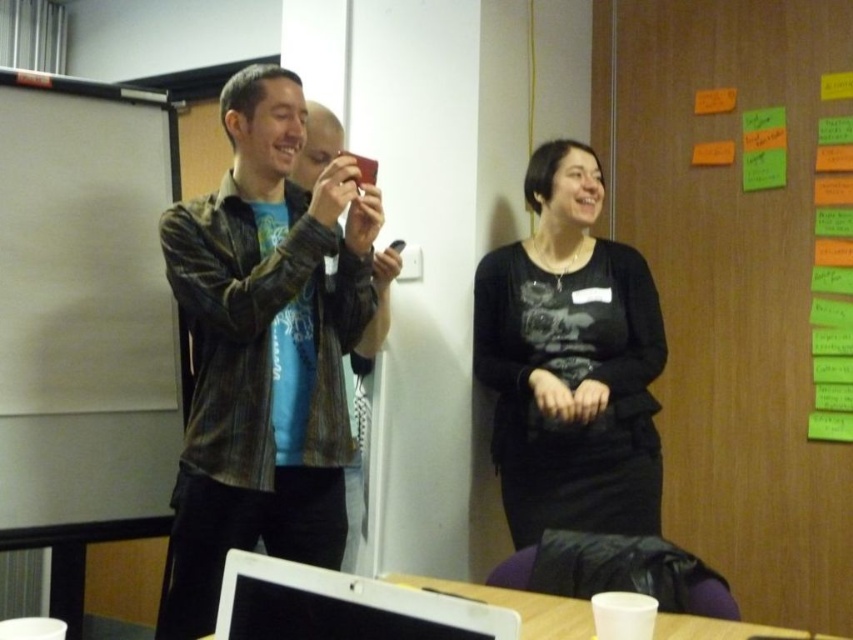
You are helping someone choose between two clothing items for an event. They have a leather jacket at center and a black matte shirt at center. If they want to wear the item that takes up more space visually, which one should they choose?

The leather jacket at center has a larger size compared to the black matte shirt at center, so they should choose the leather jacket at center as it takes up more visual space.

You are setting up for a presentation and need to ensure the projector screen is visible to all attendees. Given the leather jacket at center and the white matte projector screen at left, which object is taller and might block the screen?

The leather jacket at center is taller than the white matte projector screen at left, so it might block the screen.

You are organizing a presentation and need to decide where to place your laptop. The white matte projector screen at left and the white plastic cup at lower center are already on the table. Which object should you place the laptop closer to if you want it to be near the larger item?

You should place the laptop closer to the white matte projector screen at left because it is larger than the white plastic cup at lower center.